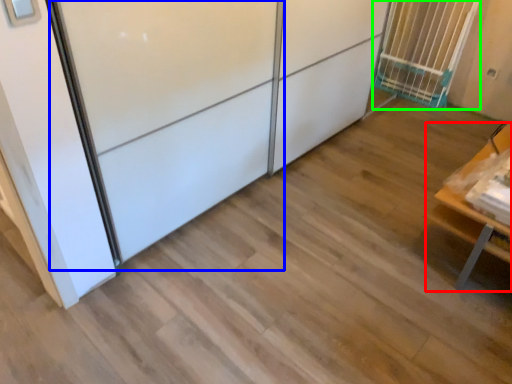
Question: Based on their relative distances, which object is farther from furniture (highlighted by a red box)? Choose from screen door (highlighted by a blue box) and cage (highlighted by a green box).

Choices:
 (A) screen door
 (B) cage

Answer: (B)